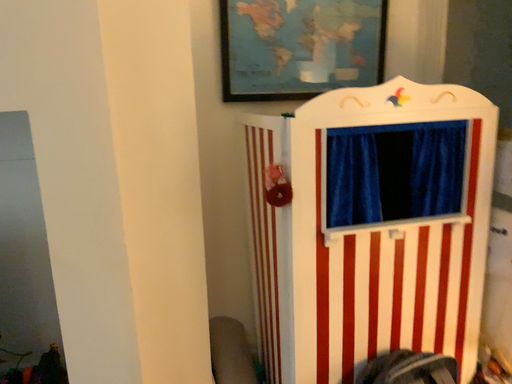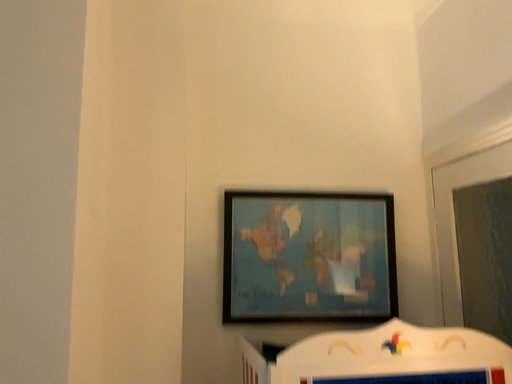
Question: Which way did the camera rotate in the video?

Choices:
 (A) rotated downward
 (B) rotated upward

Answer: (B)